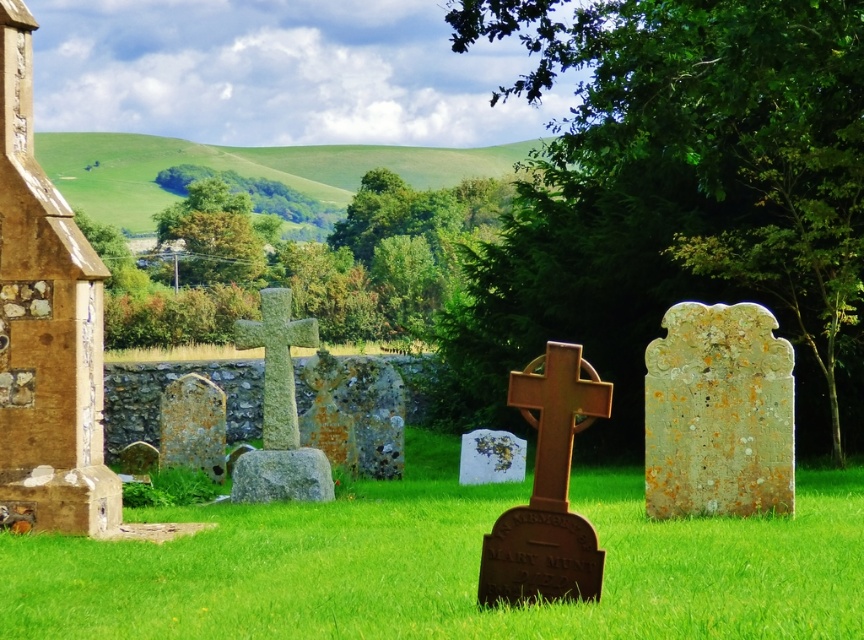
Looking at this image, can you confirm if lichen-covered stone gravestone at center-right is positioned above green stone cross at center?

Incorrect, lichen-covered stone gravestone at center-right is not positioned above green stone cross at center.

Is lichen-covered stone gravestone at center-right thinner than green stone cross at center?

No, lichen-covered stone gravestone at center-right is not thinner than green stone cross at center.

Find the location of a particular element. Image resolution: width=864 pixels, height=640 pixels. lichen-covered stone gravestone at center-right is located at coordinates (718, 413).

I want to click on lichen-covered stone gravestone at center-right, so click(x=718, y=413).

Does brown stone church at left appear on the right side of speckled stone gravestone at center-left?

Yes, brown stone church at left is to the right of speckled stone gravestone at center-left.

Based on the photo, does brown stone church at left lie in front of speckled stone gravestone at center-left?

Yes, it is in front of speckled stone gravestone at center-left.

Between point (68, 524) and point (205, 397), which one is positioned in front?

Point (68, 524) is more forward.

You are a GUI agent. You are given a task and a screenshot of the screen. Output one action in this format:
    pyautogui.click(x=<x>, y=<y>)
    Task: Click on the brown stone church at left
    Image resolution: width=864 pixels, height=640 pixels.
    Given the screenshot: What is the action you would take?
    pyautogui.click(x=45, y=328)

Is point (324, 456) positioned before point (519, 456)?

Yes, point (324, 456) is in front of point (519, 456).

Which is more to the right, gray stone gravestone at center or speckled stone gravestone at center?

Positioned to the right is speckled stone gravestone at center.

Who is more forward, (291, 461) or (468, 458)?

Point (291, 461)

Where is `gray stone gravestone at center`? The width and height of the screenshot is (864, 640). gray stone gravestone at center is located at coordinates (281, 476).